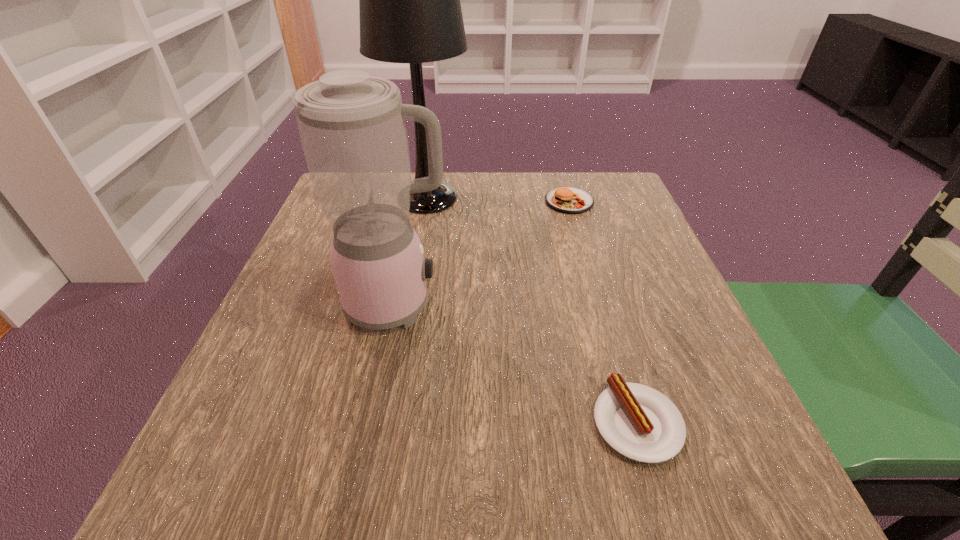
Where is `vacant space at the far edge of the desktop`? vacant space at the far edge of the desktop is located at coordinates (500, 177).

The width and height of the screenshot is (960, 540). I want to click on free space at the near edge of the desktop, so click(x=620, y=488).

Find the location of a particular element. This screenshot has width=960, height=540. vacant space at the left edge is located at coordinates (313, 319).

This screenshot has height=540, width=960. Identify the location of vacant area at the right edge of the desktop. (662, 280).

Identify the location of free space at the near left corner of the desktop. The width and height of the screenshot is (960, 540). (257, 483).

In the image, there is a desktop. Where is `vacant space at the near right corner`? Image resolution: width=960 pixels, height=540 pixels. vacant space at the near right corner is located at coordinates (774, 480).

At what (x,y) coordinates should I click in order to perform the action: click on vacant region between the second tallest object and the shortest object. Please return your answer as a coordinate pair (x, y). Image resolution: width=960 pixels, height=540 pixels. Looking at the image, I should click on (516, 363).

What are the coordinates of `empty location between the tallest object and the patty` in the screenshot? It's located at (498, 200).

What are the coordinates of `vacant area that lies between the second nearest object and the patty` in the screenshot? It's located at (483, 253).

The width and height of the screenshot is (960, 540). Identify the location of free space that is in between the tallest object and the shortest object. (532, 310).